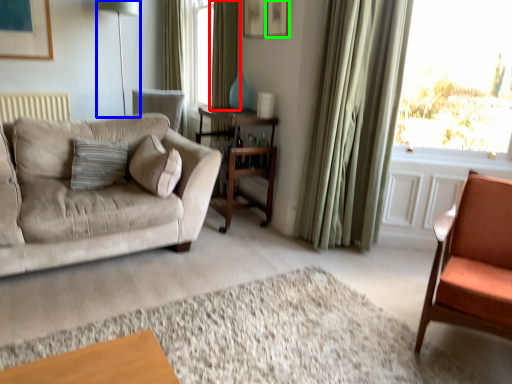
Question: Which object is positioned closest to curtain (highlighted by a red box)? Select from table lamp (highlighted by a blue box) and picture frame (highlighted by a green box).

Choices:
 (A) table lamp
 (B) picture frame

Answer: (B)